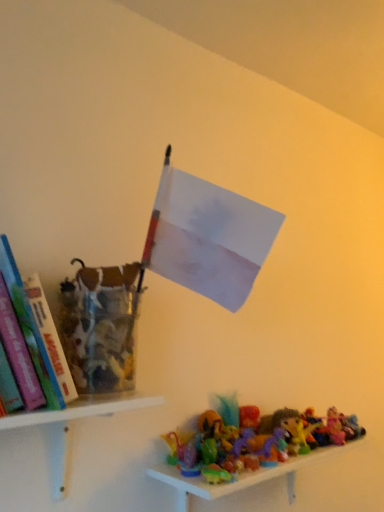
Question: From a real-world perspective, is hardcover book at left positioned under translucent plastic toys at lower right, marked as the 2th shelf in a top-to-bottom arrangement, based on gravity?

Choices:
 (A) no
 (B) yes

Answer: (A)

Question: From the image's perspective, is hardcover book at left on translucent plastic toys at lower right, which is the second shelf in left-to-right order?

Choices:
 (A) no
 (B) yes

Answer: (B)

Question: From the image's perspective, is hardcover book at left located beneath translucent plastic toys at lower right, which is the 1th shelf from right to left?

Choices:
 (A) no
 (B) yes

Answer: (A)

Question: Is hardcover book at left positioned before translucent plastic toys at lower right, positioned as the first shelf in bottom-to-top order?

Choices:
 (A) yes
 (B) no

Answer: (A)

Question: Considering the relative sizes of hardcover book at left and translucent plastic toys at lower right, positioned as the first shelf in bottom-to-top order, in the image provided, is hardcover book at left shorter than translucent plastic toys at lower right, positioned as the first shelf in bottom-to-top order,?

Choices:
 (A) yes
 (B) no

Answer: (B)

Question: Does hardcover book at left contain translucent plastic toys at lower right, which is the 1th shelf from right to left?

Choices:
 (A) yes
 (B) no

Answer: (B)

Question: From a real-world perspective, is white plastic shelf at lower left, the first shelf positioned from the left, located beneath translucent plastic toys at lower right, positioned as the first shelf in bottom-to-top order?

Choices:
 (A) yes
 (B) no

Answer: (B)

Question: Can you confirm if white plastic shelf at lower left, the first shelf positioned from the left, is shorter than translucent plastic toys at lower right, marked as the 2th shelf in a top-to-bottom arrangement?

Choices:
 (A) yes
 (B) no

Answer: (A)

Question: Is white plastic shelf at lower left, which ranks as the second shelf in bottom-to-top order, oriented towards translucent plastic toys at lower right, positioned as the first shelf in bottom-to-top order?

Choices:
 (A) no
 (B) yes

Answer: (A)

Question: Is white plastic shelf at lower left, which ranks as the second shelf in bottom-to-top order, not near translucent plastic toys at lower right, positioned as the first shelf in bottom-to-top order?

Choices:
 (A) yes
 (B) no

Answer: (B)

Question: From a real-world perspective, is white plastic shelf at lower left, the first shelf positioned from the left, physically above translucent plastic toys at lower right, positioned as the first shelf in bottom-to-top order?

Choices:
 (A) no
 (B) yes

Answer: (B)

Question: Is white plastic shelf at lower left, the first shelf when ordered from top to bottom, not inside translucent plastic toys at lower right, which is the 1th shelf from right to left?

Choices:
 (A) yes
 (B) no

Answer: (A)

Question: Is white plastic shelf at lower left, the first shelf positioned from the left, positioned before hardcover book at left?

Choices:
 (A) yes
 (B) no

Answer: (B)